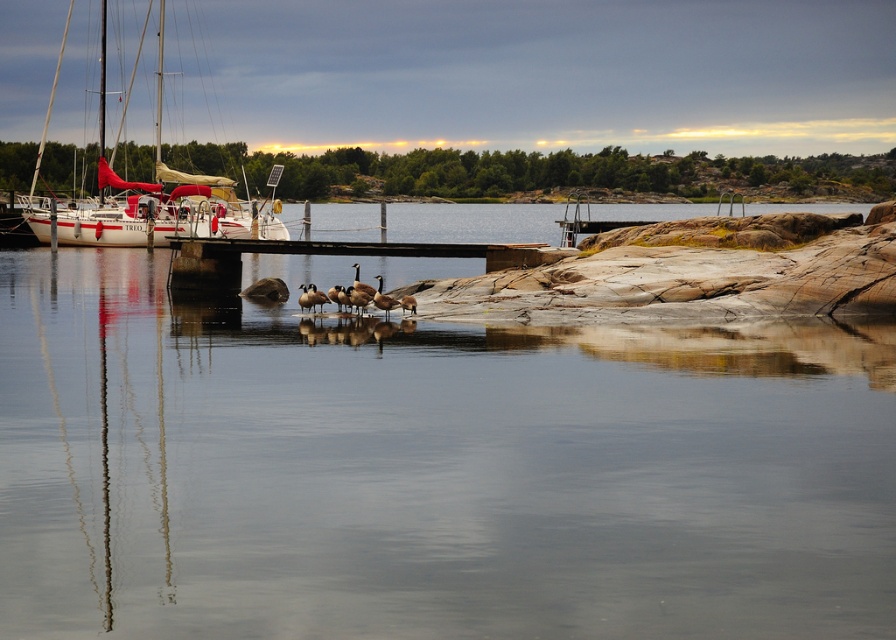
Which is in front, point (420, 266) or point (132, 234)?

Point (420, 266)

Does clear water at center have a greater height compared to white matte sailboat at left?

Incorrect, clear water at center's height is not larger of white matte sailboat at left's.

Is point (2, 396) behind point (165, 72)?

No, it is not.

You are a GUI agent. You are given a task and a screenshot of the screen. Output one action in this format:
    pyautogui.click(x=<x>, y=<y>)
    Task: Click on the clear water at center
    The width and height of the screenshot is (896, 640).
    Given the screenshot: What is the action you would take?
    [x=428, y=470]

Between clear water at center and brown wooden dock at center, which one appears on the left side from the viewer's perspective?

clear water at center is more to the left.

Can you confirm if clear water at center is positioned to the right of brown wooden dock at center?

No, clear water at center is not to the right of brown wooden dock at center.

The image size is (896, 640). In order to click on clear water at center in this screenshot , I will do `click(428, 470)`.

Does white matte sailboat at left appear over brown wooden dock at center?

Correct, white matte sailboat at left is located above brown wooden dock at center.

Who is more forward, (220, 188) or (734, 216)?

Positioned in front is point (734, 216).

Between point (62, 240) and point (544, 252), which one is positioned in front?

Point (544, 252) is more forward.

Image resolution: width=896 pixels, height=640 pixels. In order to click on white matte sailboat at left in this screenshot , I will do coord(166,208).